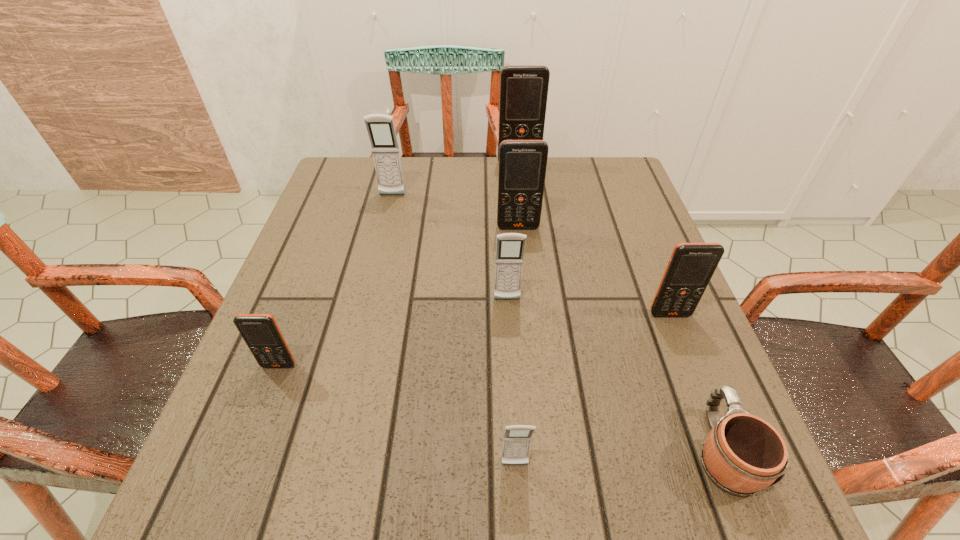
This screenshot has height=540, width=960. In order to click on gray cellular telephone identified as the second closest to the fourth farthest object in this screenshot , I will do `click(380, 127)`.

Identify which gray cellular telephone is the second nearest to the fifth nearest cellular telephone. Please provide its 2D coordinates. Your answer should be formatted as a tuple, i.e. [(x, y)], where the tuple contains the x and y coordinates of a point satisfying the conditions above.

[(380, 127)]